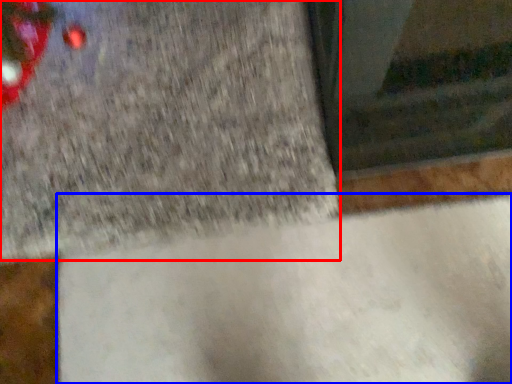
Question: Among these objects, which one is nearest to the camera, concrete (highlighted by a red box) or concrete (highlighted by a blue box)?

Choices:
 (A) concrete
 (B) concrete

Answer: (B)